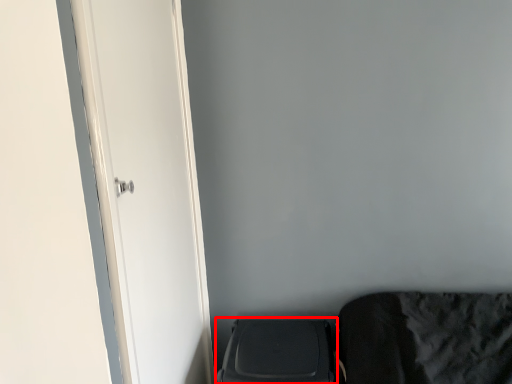
Question: From the image's perspective, where is appliance (annotated by the red box) located in relation to door in the image?

Choices:
 (A) below
 (B) above

Answer: (A)